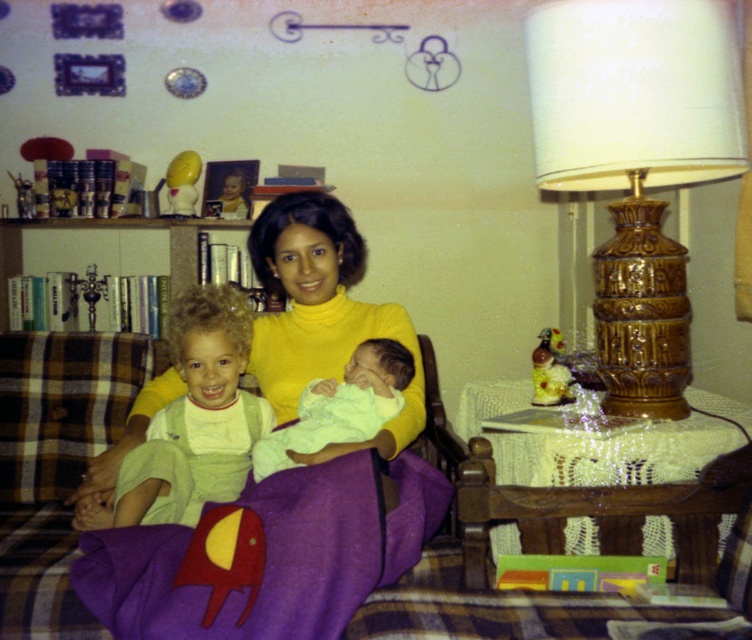
Is gold textured lamp at right above yellow turtleneck sweater at center?

Yes, gold textured lamp at right is above yellow turtleneck sweater at center.

How much distance is there between gold textured lamp at right and yellow turtleneck sweater at center?

gold textured lamp at right and yellow turtleneck sweater at center are 24.25 inches apart.

Which is behind, point (681, 0) or point (167, 397)?

The point (167, 397) is more distant.

Identify the location of gold textured lamp at right. (635, 157).

Who is positioned more to the right, yellow turtleneck sweater at center or light green fabric baby at center?

light green fabric baby at center is more to the right.

Does point (337, 291) come farther from viewer compared to point (323, 380)?

Yes, point (337, 291) is behind point (323, 380).

Is point (308, 348) positioned before point (264, 467)?

No, (308, 348) is behind (264, 467).

I want to click on yellow turtleneck sweater at center, so click(320, 312).

Is light green fabric at center to the right of light green fabric baby at center from the viewer's perspective?

No, light green fabric at center is not to the right of light green fabric baby at center.

What do you see at coordinates (193, 420) in the screenshot?
I see `light green fabric at center` at bounding box center [193, 420].

Find the location of `light green fabric at center`. light green fabric at center is located at coordinates (193, 420).